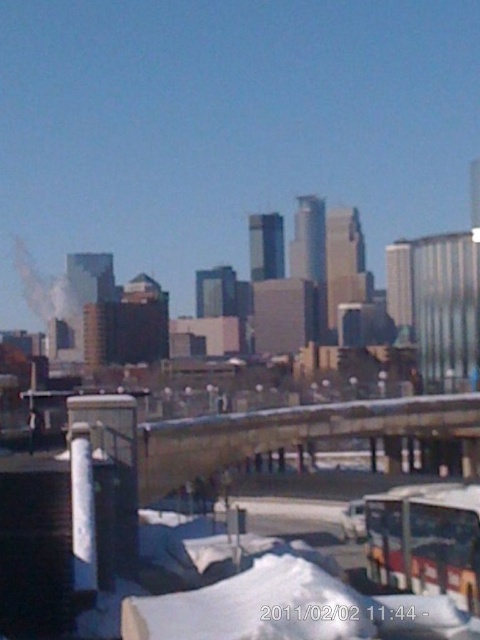
In the scene shown: You are a photographer trying to capture the entire scene in one shot. The metallic silver bus at lower right and the white smoke at left are both important elements. Given their sizes, which object might require you to adjust your camera angle to ensure it doesn not get cropped out?

The white smoke at left is larger in size compared to the metallic silver bus at lower right, so adjusting the camera angle to accommodate the larger white smoke at left would be necessary to avoid cropping it out.

You are standing at the center of the image and want to locate the metallic silver bus at lower right. In which direction should you look relative to your current position?

The metallic silver bus at lower right is located at coordinates 0.845 on the x axis and 0.890 on the y axis. Since you are at the center, which would be coordinates around 0.5 on both axes, the bus is to the northeast of your position. Therefore, you should look northeast to find the metallic silver bus at lower right.